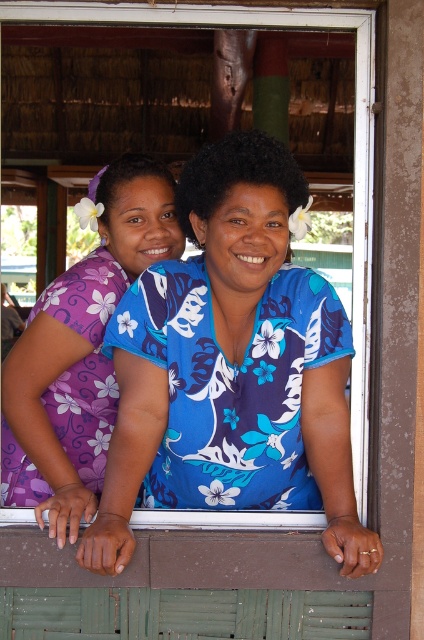
You are a photographer trying to capture a clear photo of both the blue floral shirt at center and the purple floral dress at left. What is the minimum distance you need to maintain between the camera and the subjects to ensure both are in focus?

The blue floral shirt at center and the purple floral dress at left are 14.22 inches apart. To ensure both are in focus, the camera should be positioned at least 14.22 inches away from the closest subject, which is the purple floral dress at left.

You are a photographer planning to take a group photo of the two women in the image. You want to ensure both are clearly visible. Given that the blue floral shirt at center and the purple floral dress at left are different in size, which one might you need to position closer to the camera to maintain balance in the photo?

The blue floral shirt at center is larger than the purple floral dress at left, so positioning the purple floral dress at left closer to the camera would help balance their sizes in the photo.